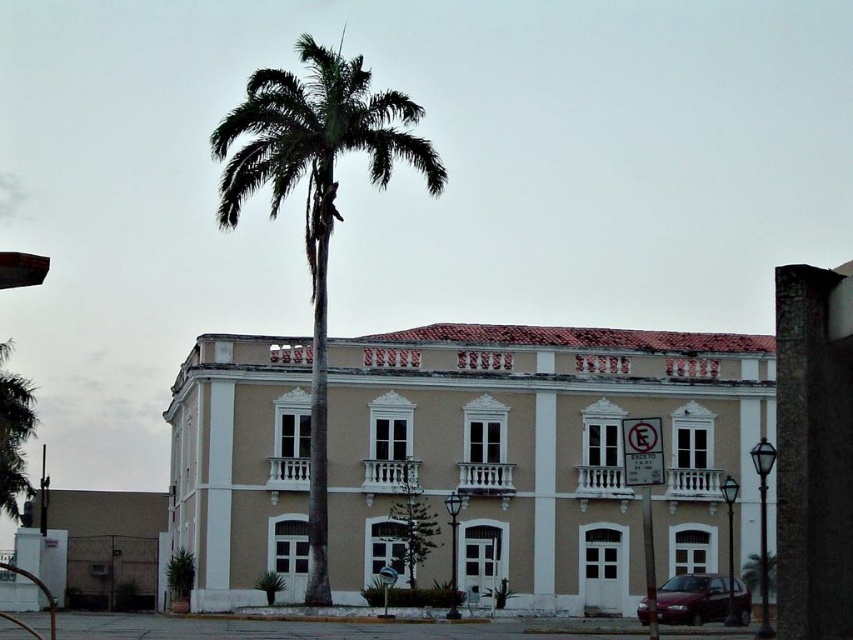
Which is in front, point (341, 502) or point (311, 120)?

Point (311, 120) is more forward.

Which of these two, beige stucco building at center or green leafy palm tree at center, stands shorter?

beige stucco building at center is shorter.

Between point (344, 563) and point (262, 148), which one is positioned behind?

Point (344, 563)

Identify the location of beige stucco building at center. (544, 452).